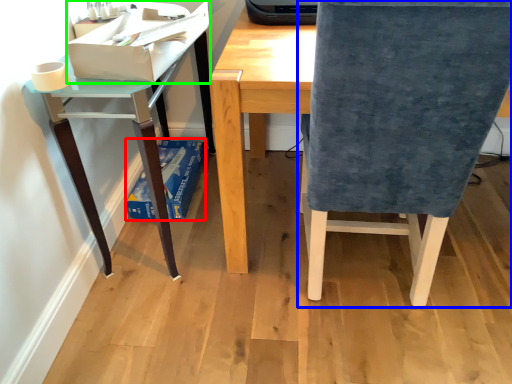
Question: Estimate the real-world distances between objects in this image. Which object is closer to paperback book (highlighted by a red box), chair (highlighted by a blue box) or paperback book (highlighted by a green box)?

Choices:
 (A) chair
 (B) paperback book

Answer: (B)